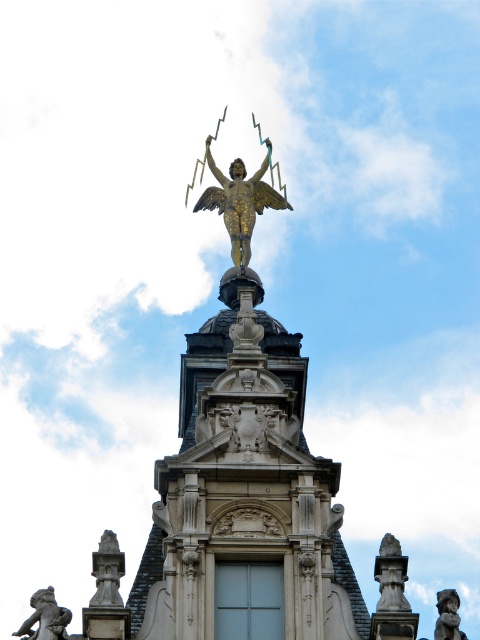
Which of these two, gold metallic statue at upper center or bronze statue at lower right, stands shorter?

With less height is gold metallic statue at upper center.

Can you confirm if gold metallic statue at upper center is positioned to the right of bronze statue at lower right?

Incorrect, gold metallic statue at upper center is not on the right side of bronze statue at lower right.

Does point (238, 198) lie behind point (450, 609)?

Yes, it is behind point (450, 609).

Identify the location of gold metallic statue at upper center. The height and width of the screenshot is (640, 480). (240, 202).

Is bronze statue at lower left wider than bronze statue at lower right?

No.

Find the location of a particular element. This screenshot has height=640, width=480. bronze statue at lower left is located at coordinates (46, 618).

The height and width of the screenshot is (640, 480). What are the coordinates of `bronze statue at lower left` in the screenshot? It's located at (46, 618).

Between point (232, 170) and point (62, 620), which one is positioned in front?

Point (62, 620)

Measure the distance between point (259, 172) and camera.

The distance of point (259, 172) from camera is 115.33 meters.

This screenshot has width=480, height=640. I want to click on gold metallic statue at upper center, so pos(240,202).

Locate an element on the screen. The image size is (480, 640). gold metallic statue at upper center is located at coordinates click(x=240, y=202).